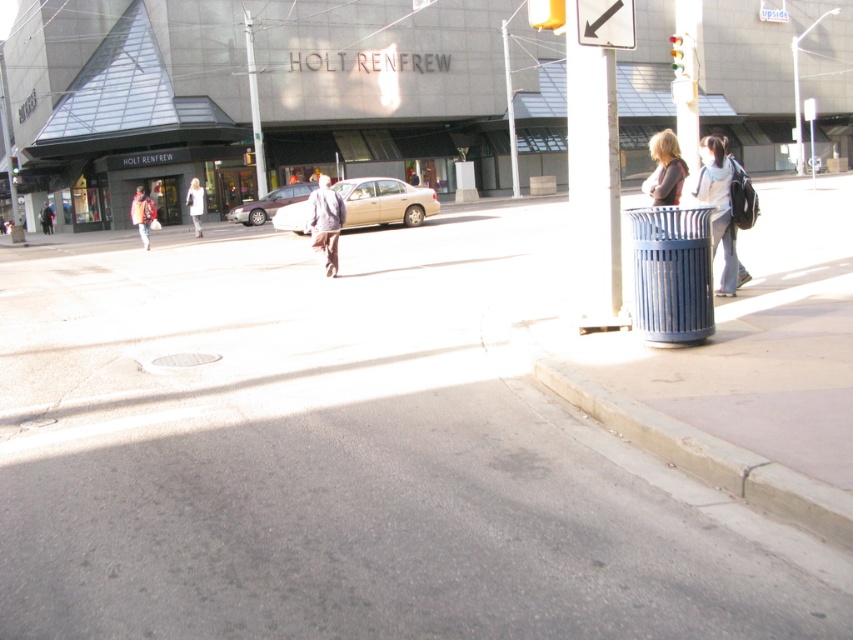
Who is positioned more to the right, gray asphalt pavement at center or matte gray sweater at upper right?

matte gray sweater at upper right

Can you confirm if gray asphalt pavement at center is bigger than matte gray sweater at upper right?

No, gray asphalt pavement at center is not bigger than matte gray sweater at upper right.

At what (x,y) coordinates should I click in order to perform the action: click on gray asphalt pavement at center. Please return your answer as a coordinate pair (x, y). This screenshot has width=853, height=640. Looking at the image, I should click on (344, 456).

Between gold metallic sedan at center and white metallic pole at upper center, which one has less height?

With less height is gold metallic sedan at center.

The width and height of the screenshot is (853, 640). Find the location of `gold metallic sedan at center`. gold metallic sedan at center is located at coordinates (384, 202).

Between point (309, 230) and point (509, 97), which one is positioned behind?

Point (509, 97)

Who is taller, light brown fabric jacket at center or white metallic pole at upper center?

white metallic pole at upper center

Which is behind, point (338, 228) or point (514, 157)?

Positioned behind is point (514, 157).

Where is `light brown fabric jacket at center`? light brown fabric jacket at center is located at coordinates (325, 221).